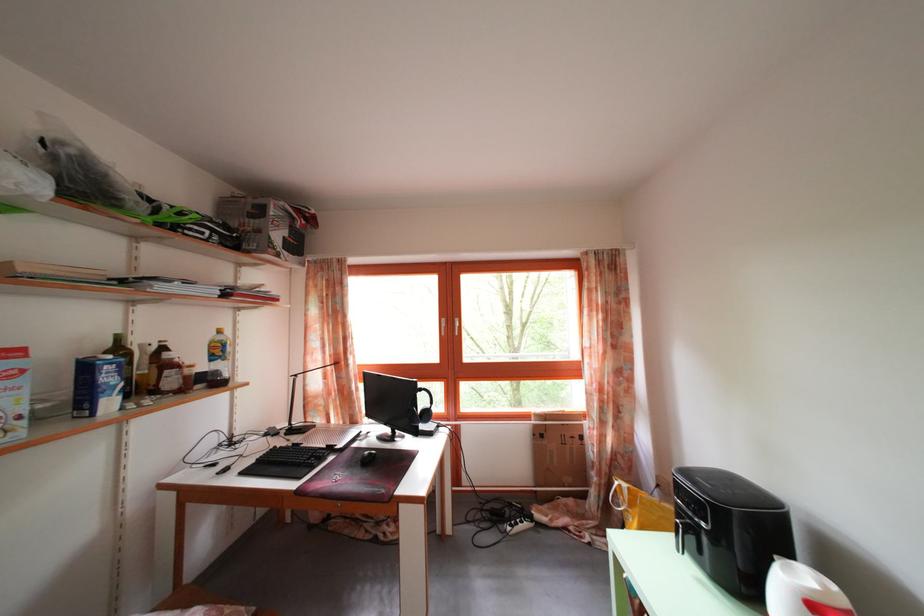
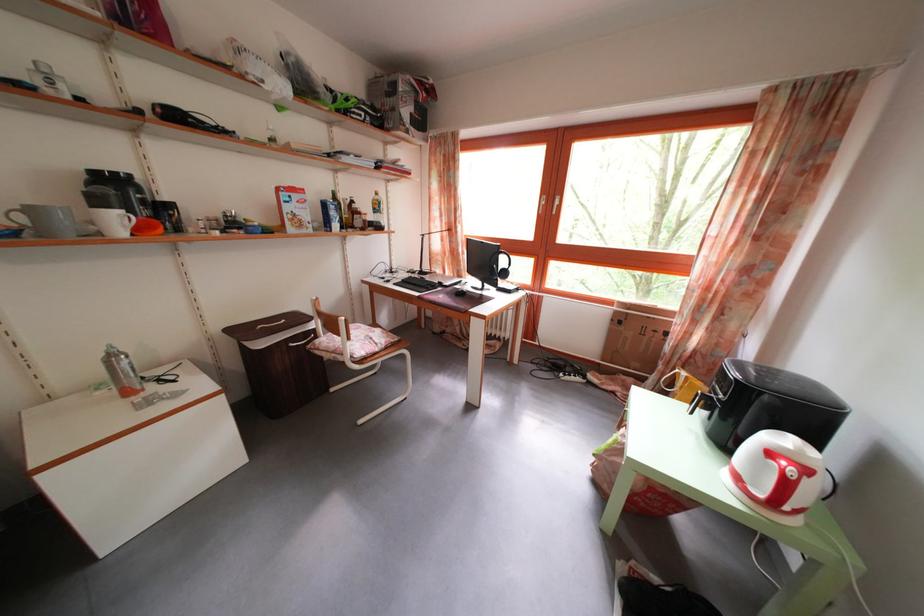
How did the camera likely rotate?

The camera rotated toward left-down.